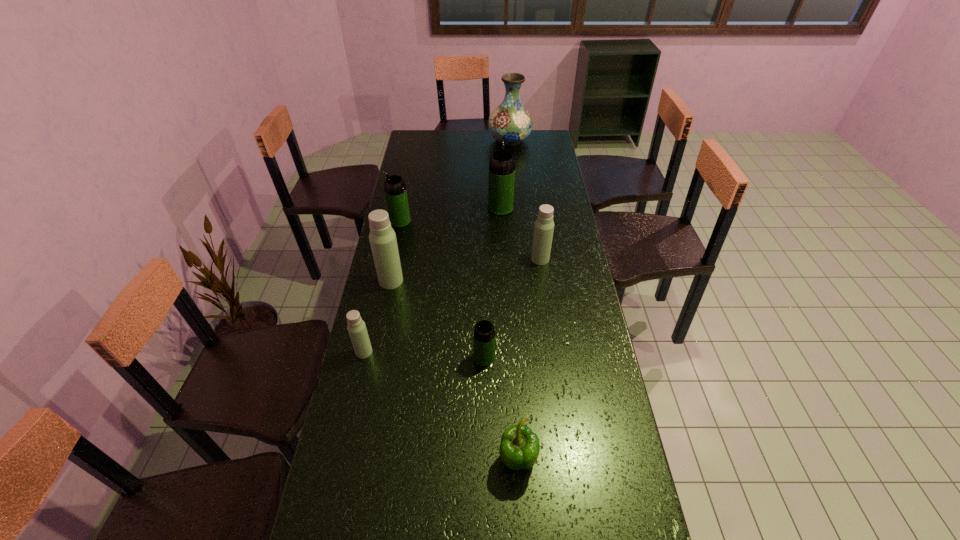
The image size is (960, 540). Find the location of `vacant space at the far left corner of the desktop`. vacant space at the far left corner of the desktop is located at coordinates (432, 142).

Where is `empty space between the farthest object and the smallest light thermos bottle`? The height and width of the screenshot is (540, 960). empty space between the farthest object and the smallest light thermos bottle is located at coordinates (437, 246).

Locate an element on the screen. The image size is (960, 540). vacant space in between the green bell pepper and the blue vase is located at coordinates pos(514,300).

Identify the location of vacant space that is in between the biggest light thermos bottle and the smallest light thermos bottle. (377, 316).

You are a GUI agent. You are given a task and a screenshot of the screen. Output one action in this format:
    pyautogui.click(x=<x>, y=<y>)
    Task: Click on the vacant space in between the fifth farthest object and the fourth farthest object
    
    Given the screenshot: What is the action you would take?
    pyautogui.click(x=466, y=270)

You are a GUI agent. You are given a task and a screenshot of the screen. Output one action in this format:
    pyautogui.click(x=<x>, y=<y>)
    Task: Click on the vacant area that lies between the blue vase and the biggest light thermos bottle
    
    Given the screenshot: What is the action you would take?
    pyautogui.click(x=450, y=211)

The width and height of the screenshot is (960, 540). What are the coordinates of `empty location between the biggest green thermos bottle and the third nearest thermos bottle` in the screenshot? It's located at (445, 245).

At what (x,y) coordinates should I click in order to perform the action: click on vacant space that's between the biggest green thermos bottle and the fourth farthest thermos bottle. Please return your answer as a coordinate pair (x, y). This screenshot has width=960, height=540. Looking at the image, I should click on (445, 245).

In order to click on vacant point located between the bell pepper and the farthest object in this screenshot , I will do `click(514, 300)`.

This screenshot has width=960, height=540. Find the location of `free space between the nearest object and the biggest green thermos bottle`. free space between the nearest object and the biggest green thermos bottle is located at coordinates (509, 334).